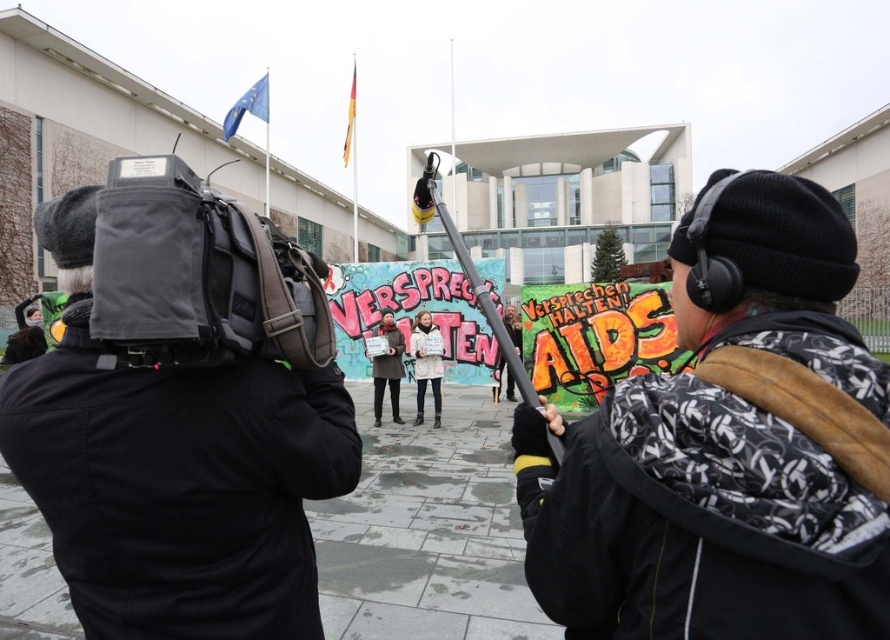
You are a drone operator trying to capture aerial footage of the protest. You have two points marked on your screen for drone positioning. The first point is at coordinates point [425,355] and the second is at point [379,333]. Which point should you choose to ensure the drone is closer to the protesters in the foreground?

Point [425,355] is in front of point [379,333], so choosing the first point will position the drone closer to the protesters in the foreground.

You are a drone operator trying to capture aerial footage of the protest. The drone must avoid the black fabric camera at left to prevent interference. Based on the coordinates provided, can you determine if the drone will pass safely above the camera?

The black fabric camera at left is located at coordinates point (174, 474). Since the drone is flying above, it will not interfere with the camera as long as it maintains altitude, so the drone can pass safely above the camera.